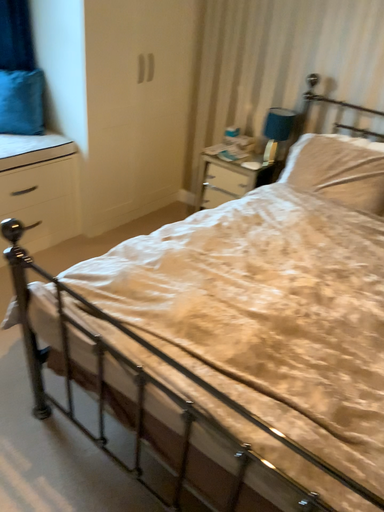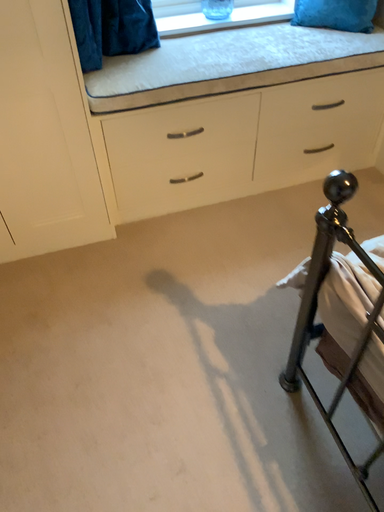
Question: How did the camera likely rotate when shooting the video?

Choices:
 (A) rotated right
 (B) rotated left

Answer: (B)